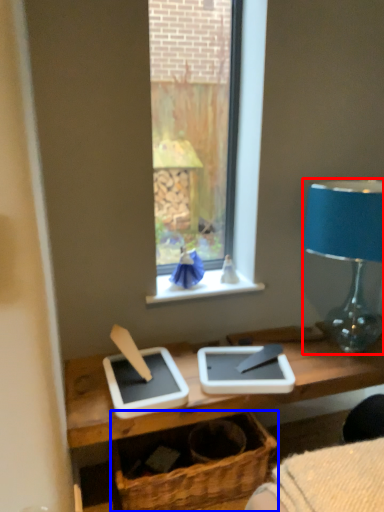
Question: Which object appears closest to the camera in this image, lamp (highlighted by a red box) or basket (highlighted by a blue box)?

Choices:
 (A) lamp
 (B) basket

Answer: (A)